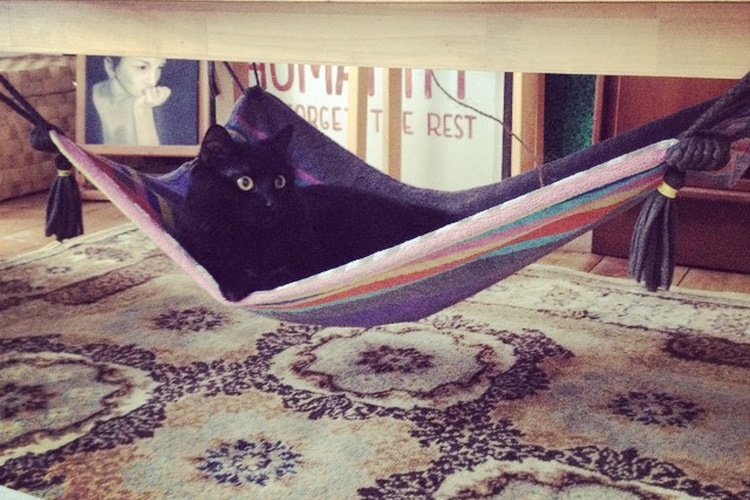
The height and width of the screenshot is (500, 750). I want to click on picture, so click(x=132, y=101).